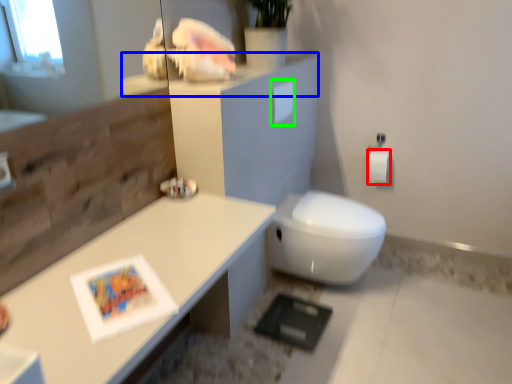
Question: Considering the real-world distances, which object is farthest from toilet paper (highlighted by a red box)? ledge (highlighted by a blue box) or toilet paper (highlighted by a green box)?

Choices:
 (A) ledge
 (B) toilet paper

Answer: (A)